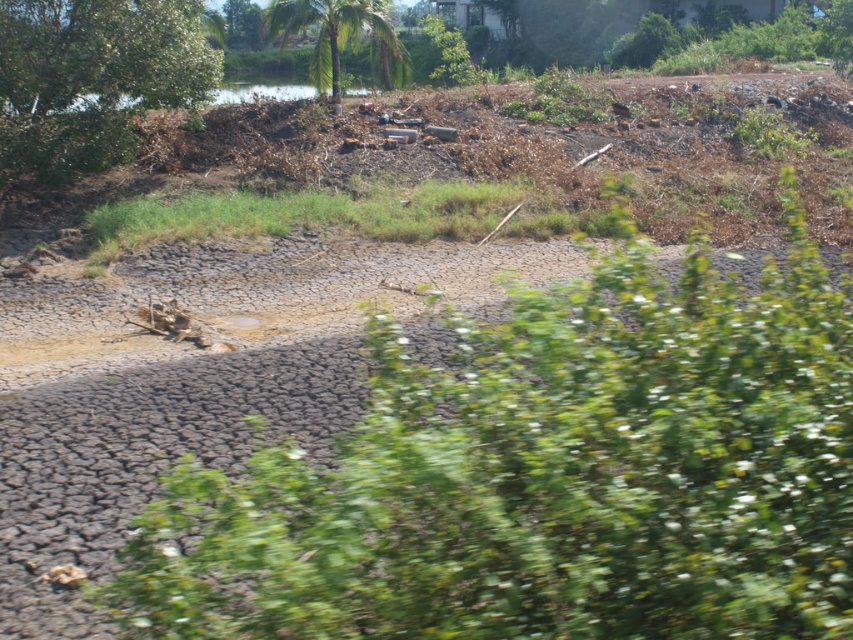
From the picture: Can you confirm if green leafy tree at upper left is positioned below green leafy palm at upper center?

Indeed, green leafy tree at upper left is positioned under green leafy palm at upper center.

Does green leafy tree at upper left have a greater height compared to green leafy palm at upper center?

In fact, green leafy tree at upper left may be shorter than green leafy palm at upper center.

What do you see at coordinates (93, 77) in the screenshot?
I see `green leafy tree at upper left` at bounding box center [93, 77].

Locate an element on the screen. The width and height of the screenshot is (853, 640). green leafy tree at upper left is located at coordinates (93, 77).

Is the position of green leafy tree at center less distant than that of green leafy palm at upper center?

Yes, green leafy tree at center is in front of green leafy palm at upper center.

Is point (659, 461) farther from camera compared to point (332, 56)?

No, it is not.

Is point (840, 468) positioned before point (354, 51)?

Yes, it is in front of point (354, 51).

Locate an element on the screen. This screenshot has width=853, height=640. green leafy tree at center is located at coordinates (547, 477).

Is green leafy tree at center to the right of green leafy tree at upper left from the viewer's perspective?

Correct, you'll find green leafy tree at center to the right of green leafy tree at upper left.

Can you confirm if green leafy tree at center is positioned above green leafy tree at upper left?

Incorrect, green leafy tree at center is not positioned above green leafy tree at upper left.

Is point (703, 268) less distant than point (96, 36)?

Yes.

Identify the location of green leafy tree at center. (547, 477).